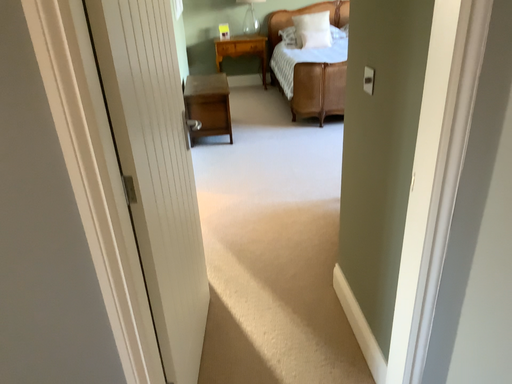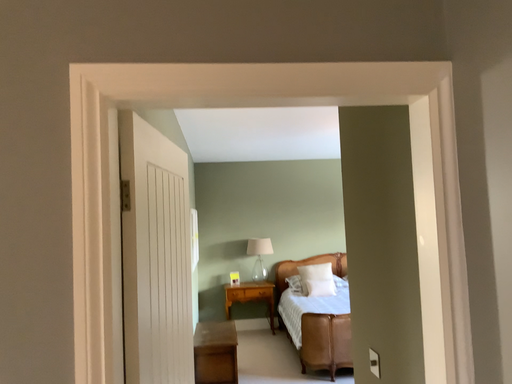
Question: Which way did the camera rotate in the video?

Choices:
 (A) rotated downward
 (B) rotated upward

Answer: (B)